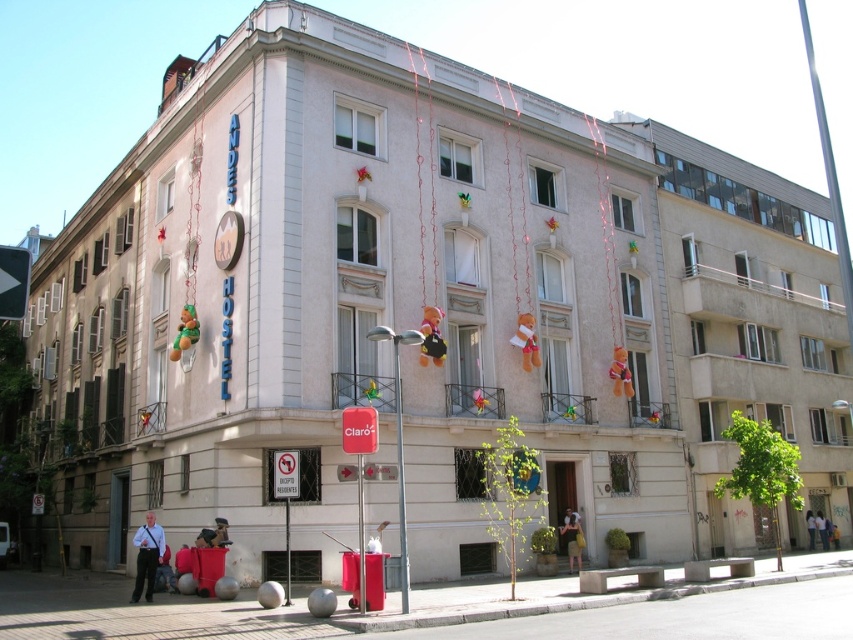
Does white plastic sign at lower center have a lesser height compared to light brown leather backpack at lower center?

No, white plastic sign at lower center is not shorter than light brown leather backpack at lower center.

What do you see at coordinates (285, 474) in the screenshot?
I see `white plastic sign at lower center` at bounding box center [285, 474].

This screenshot has height=640, width=853. In order to click on white plastic sign at lower center in this screenshot , I will do `click(285, 474)`.

Does brushed metal pole at center have a smaller size compared to light brown leather backpack at lower center?

No.

Is point (402, 339) closer to viewer compared to point (572, 532)?

That is True.

The height and width of the screenshot is (640, 853). In order to click on brushed metal pole at center in this screenshot , I will do `click(399, 477)`.

Who is higher up, white plastic sign at center or light blue jeans at lower center?

white plastic sign at center

Which is below, white plastic sign at center or light blue jeans at lower center?

Positioned lower is light blue jeans at lower center.

The image size is (853, 640). What do you see at coordinates (358, 429) in the screenshot?
I see `white plastic sign at center` at bounding box center [358, 429].

At what (x,y) coordinates should I click in order to perform the action: click on white plastic sign at center. Please return your answer as a coordinate pair (x, y). The height and width of the screenshot is (640, 853). Looking at the image, I should click on (358, 429).